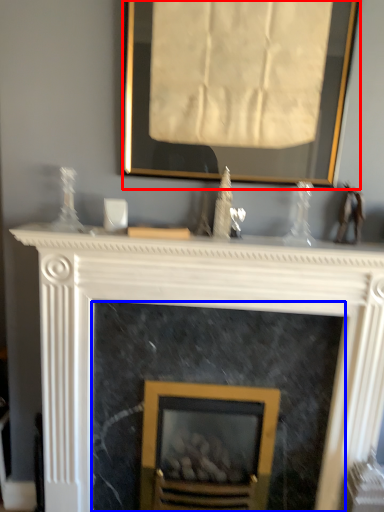
Question: Which point is further to the camera, picture frame (highlighted by a red box) or fireplace (highlighted by a blue box)?

Choices:
 (A) picture frame
 (B) fireplace

Answer: (B)